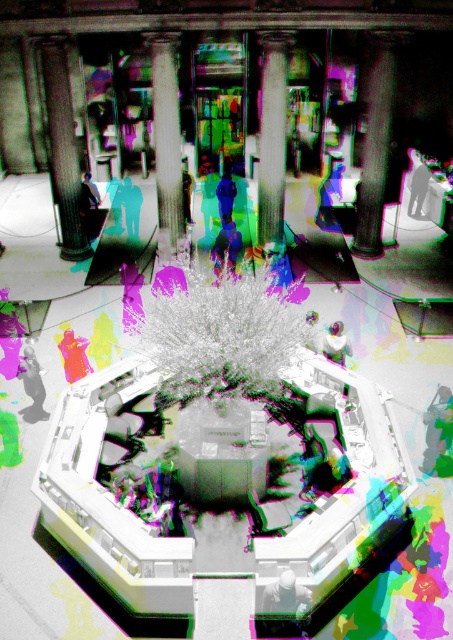
Is point (380, 204) in front of point (261, 131)?

No, it is behind (261, 131).

Does smooth gray column at right come in front of white glossy pillar at center?

No, it is behind white glossy pillar at center.

Is point (374, 216) in front of point (274, 33)?

No, (374, 216) is behind (274, 33).

Locate an element on the screen. This screenshot has width=453, height=640. smooth gray column at right is located at coordinates (375, 145).

Can you confirm if smooth white pillar at center is positioned below white glossy pillar at center?

Incorrect, smooth white pillar at center is not positioned below white glossy pillar at center.

Is smooth white pillar at center positioned behind white glossy pillar at center?

No, smooth white pillar at center is closer to the viewer.

This screenshot has height=640, width=453. Identify the location of smooth white pillar at center. (167, 145).

Who is more distant from viewer, (381, 97) or (178, 246)?

The point (178, 246) is more distant.

Can you confirm if smooth gray column at right is positioned above smooth white pillar at center?

Actually, smooth gray column at right is below smooth white pillar at center.

You are a GUI agent. You are given a task and a screenshot of the screen. Output one action in this format:
    pyautogui.click(x=<x>, y=<y>)
    Task: Click on the smooth gray column at right
    This screenshot has width=453, height=640.
    Given the screenshot: What is the action you would take?
    pyautogui.click(x=375, y=145)